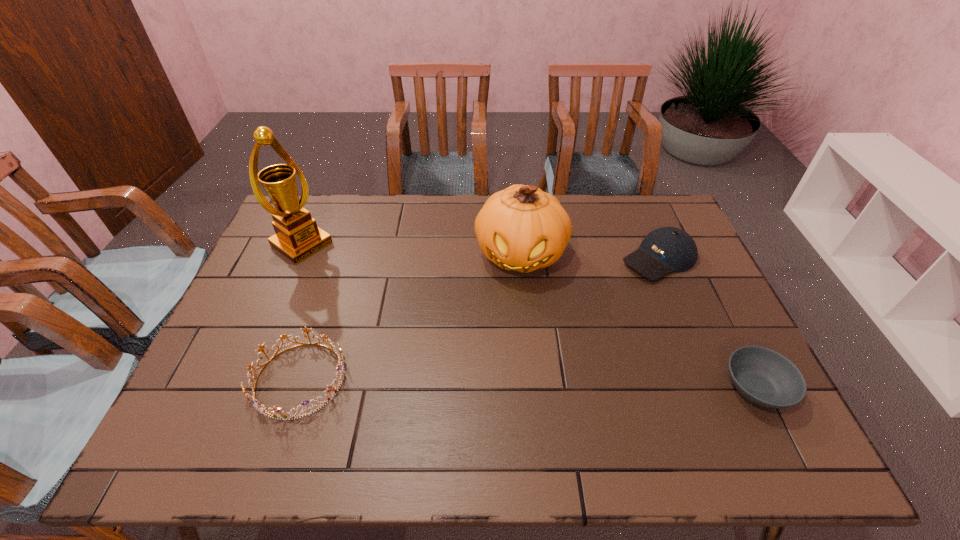
Where is `vacant space at the near edge`? The image size is (960, 540). vacant space at the near edge is located at coordinates (595, 396).

In the image, there is a desktop. Identify the location of vacant space at the left edge. Image resolution: width=960 pixels, height=540 pixels. (218, 340).

Where is `vacant region at the right edge of the desktop`? vacant region at the right edge of the desktop is located at coordinates (660, 287).

Find the location of a particular element. The image size is (960, 540). free space at the far right corner is located at coordinates (627, 197).

In order to click on vacant space that is in between the tiara and the soup bowl in this screenshot , I will do `click(528, 384)`.

Where is `free spot between the soup bowl and the award`? Image resolution: width=960 pixels, height=540 pixels. free spot between the soup bowl and the award is located at coordinates (529, 316).

What are the coordinates of `empty space that is in between the baseball cap and the soup bowl` in the screenshot? It's located at (708, 323).

What are the coordinates of `free space between the tallest object and the soup bowl` in the screenshot? It's located at (529, 316).

Find the location of a particular element. This screenshot has width=960, height=540. vacant area that lies between the award and the fourth tallest object is located at coordinates (300, 312).

Where is `vacant space that is in between the baseball cap and the tiara`? vacant space that is in between the baseball cap and the tiara is located at coordinates (479, 319).